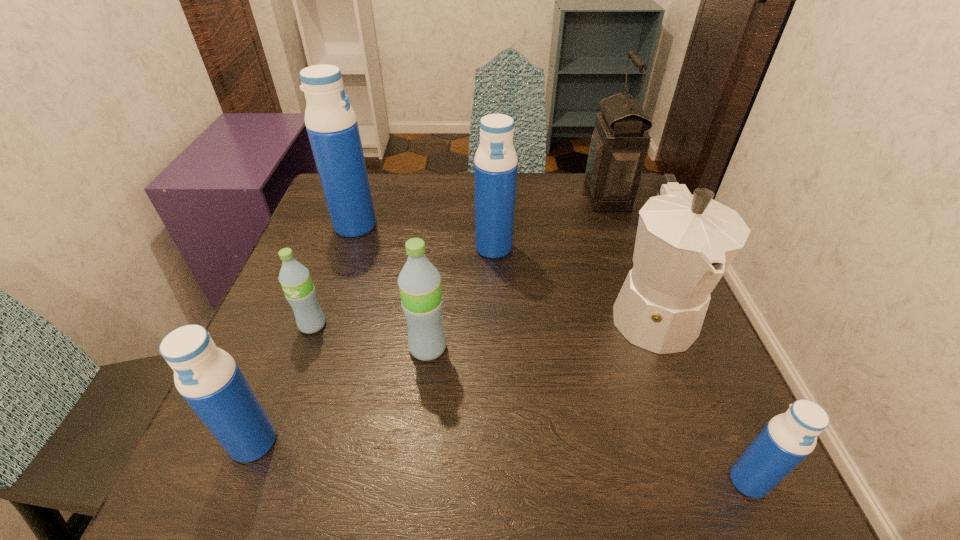
Locate an element on the screen. object present at the near right corner is located at coordinates (788, 438).

At what (x,y) coordinates should I click in order to perform the action: click on vacant space at the far edge of the desktop. Please return your answer as a coordinate pair (x, y). The width and height of the screenshot is (960, 540). Looking at the image, I should click on (412, 214).

I want to click on free space at the near edge of the desktop, so click(331, 472).

The height and width of the screenshot is (540, 960). I want to click on vacant space at the left edge of the desktop, so click(276, 365).

Find the location of `vacant region at the right edge`. vacant region at the right edge is located at coordinates (684, 435).

Where is `vacant space at the far right corner`? The image size is (960, 540). vacant space at the far right corner is located at coordinates (634, 205).

Identify the location of free spot between the gray lantern and the smaller green water bottle. Image resolution: width=960 pixels, height=540 pixels. (460, 261).

You are a GUI agent. You are given a task and a screenshot of the screen. Output one action in this format:
    pyautogui.click(x=<x>, y=<y>)
    Task: Click on the free area in between the gray coffeepot and the lantern
    The width and height of the screenshot is (960, 540).
    Given the screenshot: What is the action you would take?
    pyautogui.click(x=629, y=254)

Locate an element on the screen. vacant region between the third smallest blue water bottle and the second smallest blue water bottle is located at coordinates 373,345.

Locate an element on the screen. The width and height of the screenshot is (960, 540). vacant space in between the third biggest blue water bottle and the fifth object from left to right is located at coordinates [373, 345].